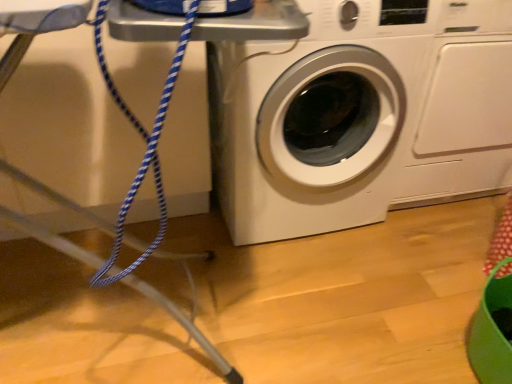
Question: Is white glossy washing machine at center, the 2th washing machine positioned from the left, situated inside white glossy washing machine at center, placed as the 2th washing machine when sorted from right to left, or outside?

Choices:
 (A) inside
 (B) outside

Answer: (B)

Question: Relative to white glossy washing machine at center, which is the 1th washing machine in left-to-right order, is white glossy washing machine at center, the 2th washing machine positioned from the left, in front or behind?

Choices:
 (A) behind
 (B) front

Answer: (A)

Question: In terms of width, does white glossy washing machine at center, the first washing machine from the right, look wider or thinner when compared to white glossy washing machine at center, which is the 1th washing machine in left-to-right order?

Choices:
 (A) wide
 (B) thin

Answer: (B)

Question: Is white glossy washing machine at center, placed as the 2th washing machine when sorted from right to left, to the left or to the right of white glossy washing machine at center, the first washing machine from the right, in the image?

Choices:
 (A) left
 (B) right

Answer: (A)

Question: Considering the positions of white glossy washing machine at center, which is the 1th washing machine in left-to-right order, and white glossy washing machine at center, the first washing machine from the right, in the image, is white glossy washing machine at center, which is the 1th washing machine in left-to-right order, taller or shorter than white glossy washing machine at center, the first washing machine from the right,?

Choices:
 (A) short
 (B) tall

Answer: (B)

Question: Based on their sizes in the image, would you say white glossy washing machine at center, placed as the 2th washing machine when sorted from right to left, is bigger or smaller than white glossy washing machine at center, the first washing machine from the right?

Choices:
 (A) big
 (B) small

Answer: (A)

Question: From the image's perspective, relative to white glossy washing machine at center, the first washing machine from the right, is white glossy washing machine at center, placed as the 2th washing machine when sorted from right to left, above or below?

Choices:
 (A) above
 (B) below

Answer: (B)